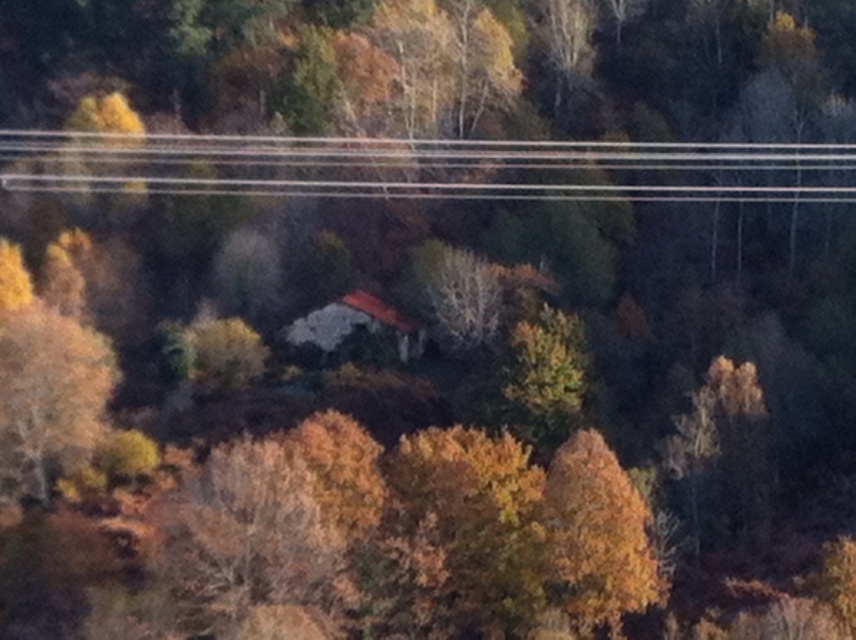
You are a bird flying over the autumn landscape. You want to land on the highest point between the clear plastic power lines at upper center and the golden textured tree at left. Which one should you choose?

The golden textured tree at left is taller than the clear plastic power lines at upper center, so you should choose the golden textured tree at left to land on the highest point.

You are an electrician assessing the scene. You need to determine if the clear plastic power lines at upper center can be safely installed without obstructing the golden textured tree at left. Based on their widths, is this feasible?

The clear plastic power lines at upper center might be wider than golden textured tree at left, so there is a possibility of obstruction. Further measurements or adjustments may be needed to ensure safe installation.

You are a photographer standing at the edge of an autumn forest. You want to capture both the point at coordinates point (242, 144) and the point at coordinates point (15, 342) in your photo. Which point will appear closer to the top edge of your camera frame?

Point (242, 144) is further to the camera than point (15, 342), so the point at coordinates point (242, 144) will appear closer to the top edge of your camera frame.